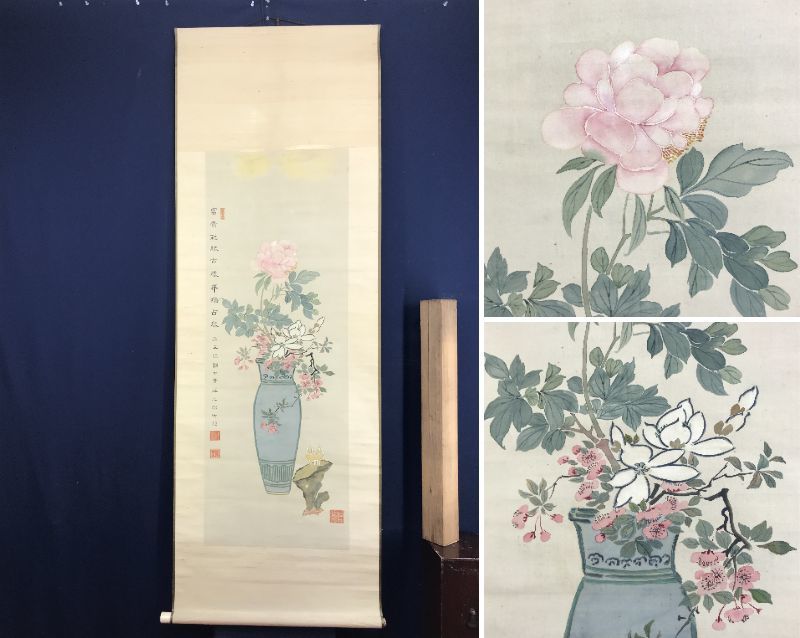
Image resolution: width=800 pixels, height=638 pixels. In order to click on vase in this screenshot , I will do `click(578, 595)`.